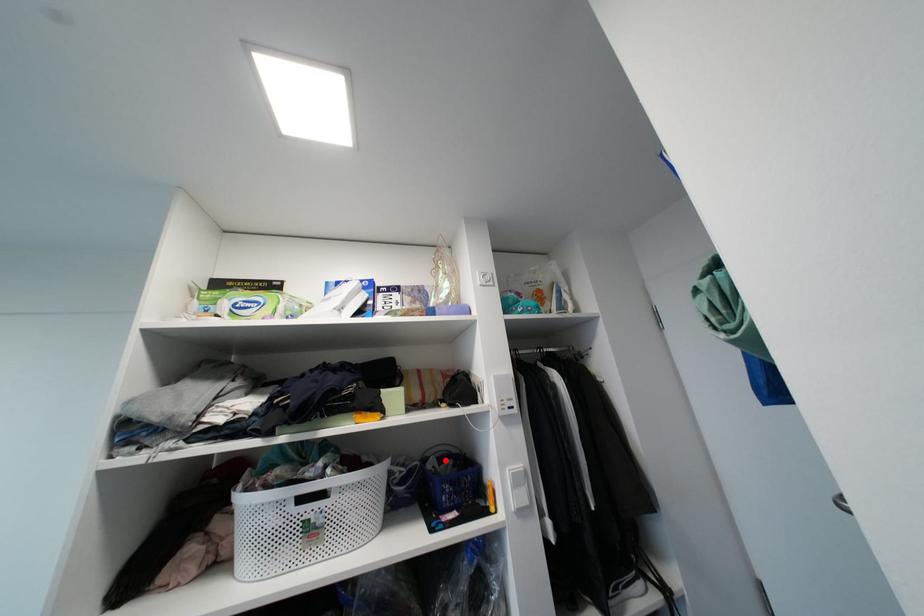
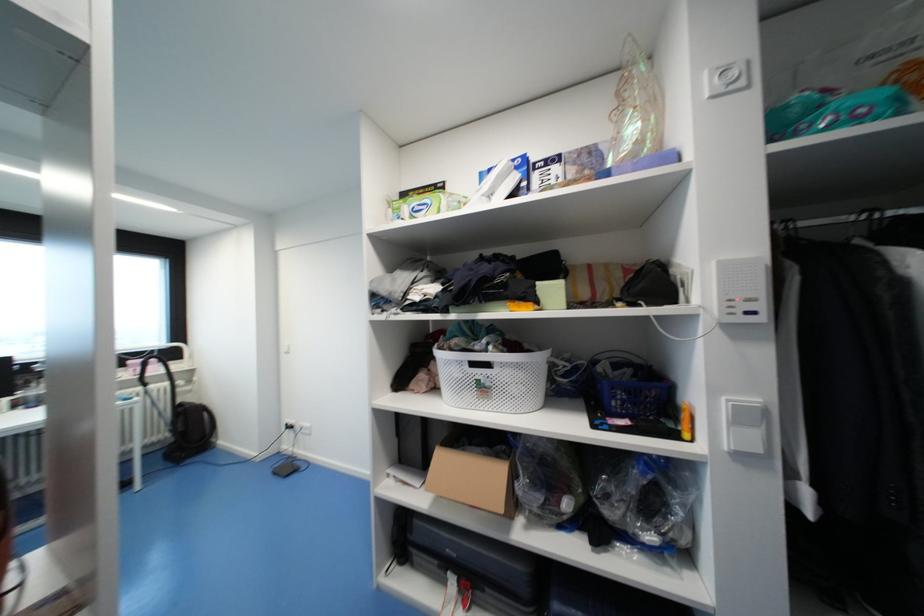
Question: A red point is marked in image1. In image2, is the corresponding 3D point closer to the camera or farther? Reply with the corresponding letter.

Choices:
 (A) The corresponding 3D point is closer.
 (B) The corresponding 3D point is farther.

Answer: (A)